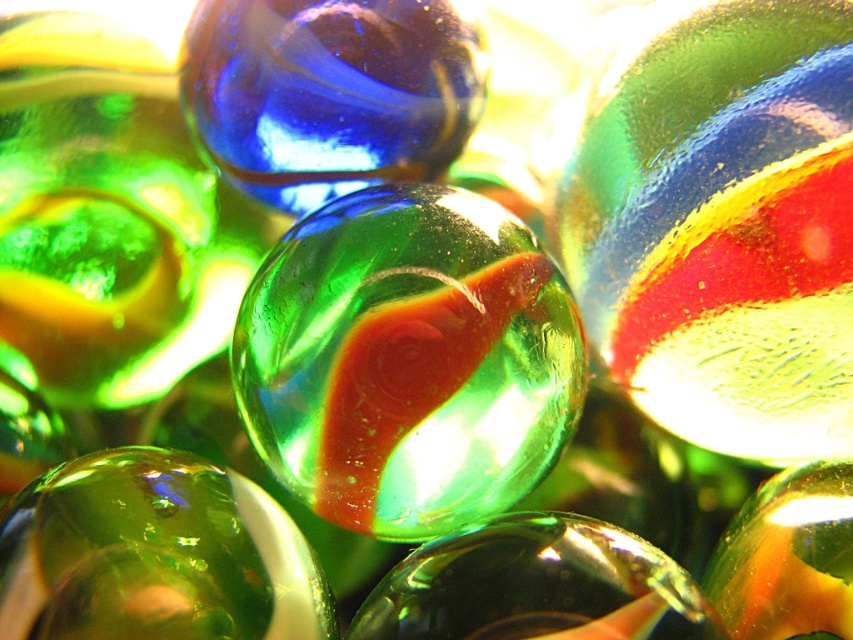
Who is shorter, green translucent marble at center or green translucent sphere at center?

Standing shorter between the two is green translucent sphere at center.

Does green translucent marble at center have a lesser height compared to green translucent sphere at center?

No, green translucent marble at center is not shorter than green translucent sphere at center.

This screenshot has width=853, height=640. I want to click on green translucent marble at center, so coord(408,360).

Who is higher up, green translucent sphere at center or green glossy marble at center?

green translucent sphere at center is above.

Can you confirm if green translucent sphere at center is positioned to the right of green glossy marble at center?

In fact, green translucent sphere at center is to the left of green glossy marble at center.

Between point (318, 572) and point (590, 586), which one is positioned behind?

The point (318, 572) is behind.

This screenshot has height=640, width=853. I want to click on green translucent sphere at center, so click(154, 554).

Does green translucent marble at center have a lesser width compared to green glossy marble at center?

Incorrect, green translucent marble at center's width is not less than green glossy marble at center's.

Does green translucent marble at center appear on the left side of green glossy marble at center?

Indeed, green translucent marble at center is positioned on the left side of green glossy marble at center.

Does point (277, 435) come behind point (374, 620)?

Yes.

Locate an element on the screen. The height and width of the screenshot is (640, 853). green translucent marble at center is located at coordinates (408, 360).